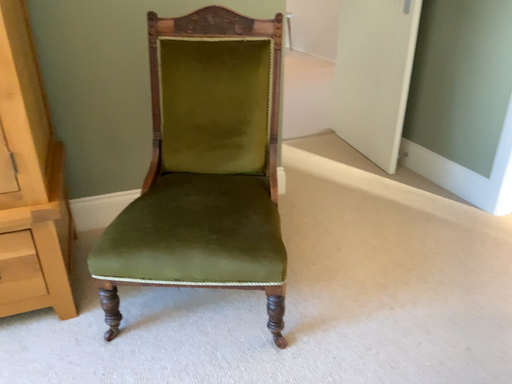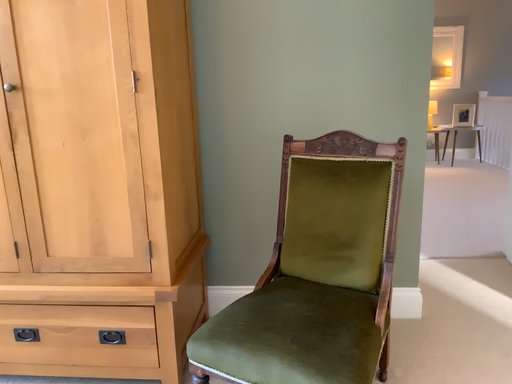
Question: How did the camera likely rotate when shooting the video?

Choices:
 (A) rotated left
 (B) rotated right

Answer: (A)